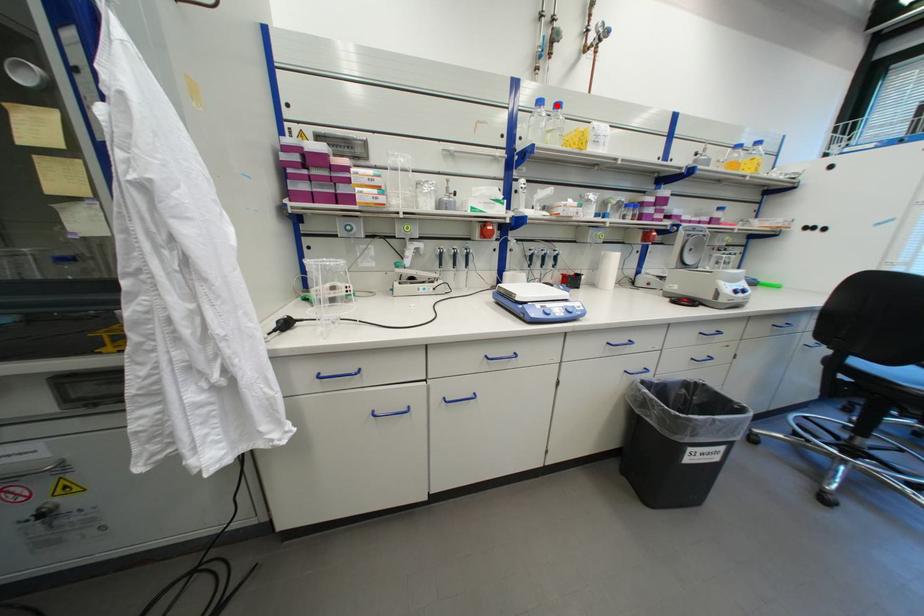
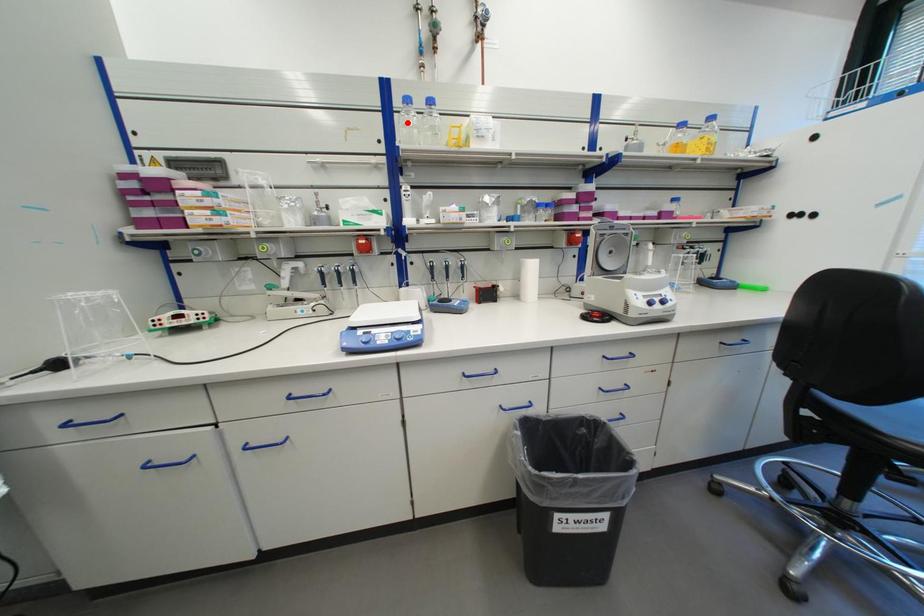
I am providing you with two images of the same scene from different viewpoints. A red point is marked on the first image and another point is marked on the second image. Do the highlighted points in image1 and image2 indicate the same real-world spot?

No